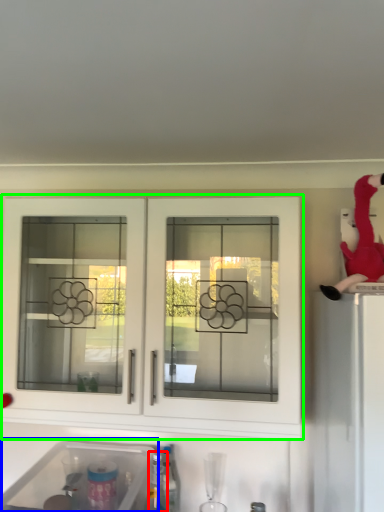
Question: Based on their relative distances, which object is farther from bottle (highlighted by a red box)? Choose from sink (highlighted by a blue box) and cabinetry (highlighted by a green box).

Choices:
 (A) sink
 (B) cabinetry

Answer: (B)